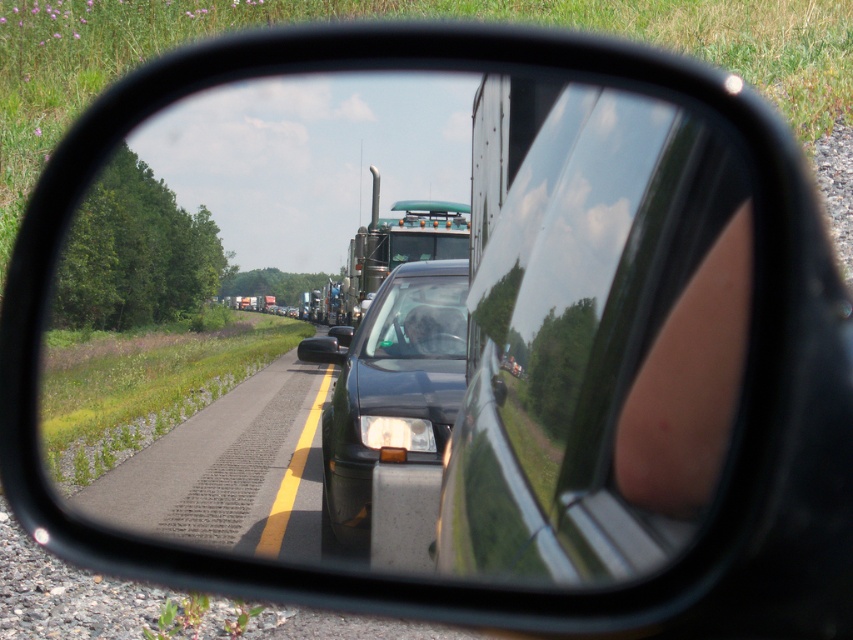
You are driving a car and want to change lanes. You check your side mirror and see the glossy metallic mirror at center and the asphalt road at lower left. Based on the distance between them, can your car, which is 4.5 meters long, safely make a lane change without encroaching on the other lane?

The distance between the glossy metallic mirror at center and the asphalt road at lower left is 6.11 meters. Since your car is 4.5 meters long, there is enough space to safely make the lane change without encroaching on the other lane.

You are a driver checking your side mirror and see the asphalt road at lower left and the shiny black sedan at center. Which object appears taller in the reflection?

The shiny black sedan at center appears taller than the asphalt road at lower left in the reflection.

You are driving a car and notice your side mirror, which is the glossy metallic mirror at center, and the shiny black sedan at center reflected in it. Based on their sizes in the reflection, which object appears smaller?

The glossy metallic mirror at center appears smaller compared to the shiny black sedan at center in the reflection.